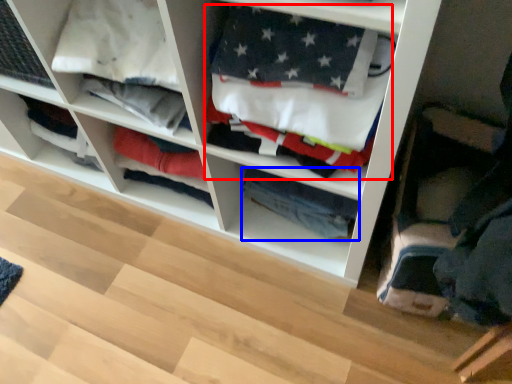
Question: Which of the following is the closest to the observer, clothing (highlighted by a red box) or clothing (highlighted by a blue box)?

Choices:
 (A) clothing
 (B) clothing

Answer: (A)